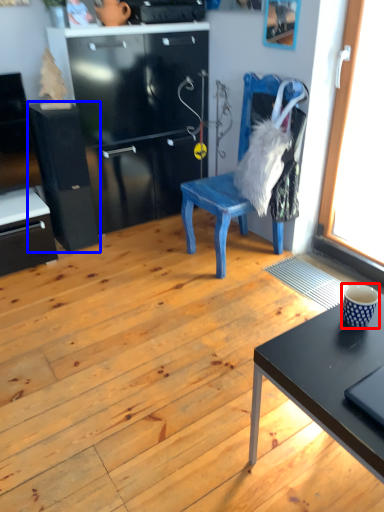
Question: Which object is further to the camera taking this photo, coffee cup (highlighted by a red box) or file cabinet (highlighted by a blue box)?

Choices:
 (A) coffee cup
 (B) file cabinet

Answer: (B)